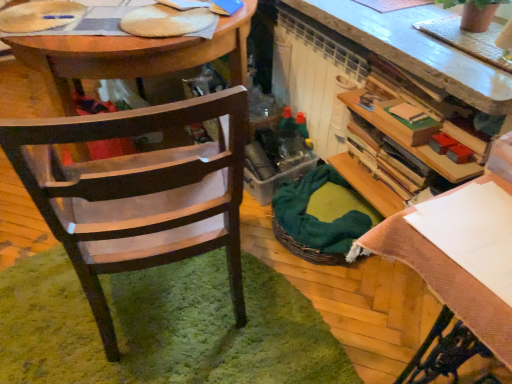
Question: Based on their positions, is wooden desk at center located to the left or right of green woven picnic basket at center?

Choices:
 (A) right
 (B) left

Answer: (B)

Question: From their relative heights in the image, would you say wooden desk at center is taller or shorter than green woven picnic basket at center?

Choices:
 (A) tall
 (B) short

Answer: (A)

Question: Which is farther from the green woven picnic basket at center?

Choices:
 (A) terracotta textured pot at upper right
 (B) wooden chair at left
 (C) white paper at upper right
 (D) wooden desk at center

Answer: (A)

Question: Estimate the real-world distances between objects in this image. Which object is closer to the green woven picnic basket at center?

Choices:
 (A) wooden chair at left
 (B) white paper at upper right
 (C) wooden desk at center
 (D) terracotta textured pot at upper right

Answer: (A)